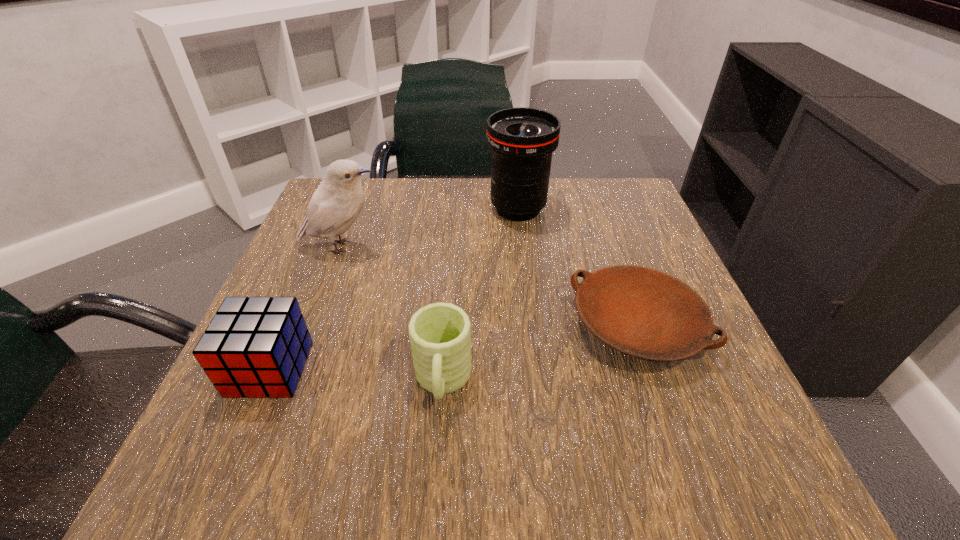
You are a GUI agent. You are given a task and a screenshot of the screen. Output one action in this format:
    pyautogui.click(x=<x>, y=<y>)
    Task: Click on the farthest object
    
    Given the screenshot: What is the action you would take?
    pyautogui.click(x=521, y=139)

Locate an element on the screen. This screenshot has height=540, width=960. bird is located at coordinates (336, 203).

This screenshot has height=540, width=960. Identify the location of mug. (440, 333).

This screenshot has height=540, width=960. I want to click on cube, so click(x=256, y=347).

Identify the location of the shortest object. point(644,313).

I want to click on free point located on the right of the farthest object, so click(585, 209).

The width and height of the screenshot is (960, 540). Find the location of `free space located at the beak of the bird`. free space located at the beak of the bird is located at coordinates (544, 247).

Image resolution: width=960 pixels, height=540 pixels. Identify the location of free region located 0.080m on the side of the mug with the handle. (436, 477).

At what (x,y) coordinates should I click in order to perform the action: click on free location located 0.090m on the back of the cube. Please return your answer as a coordinate pair (x, y). Looking at the image, I should click on (299, 303).

Image resolution: width=960 pixels, height=540 pixels. Find the location of `free space located 0.150m on the front of the shortest object`. free space located 0.150m on the front of the shortest object is located at coordinates (691, 479).